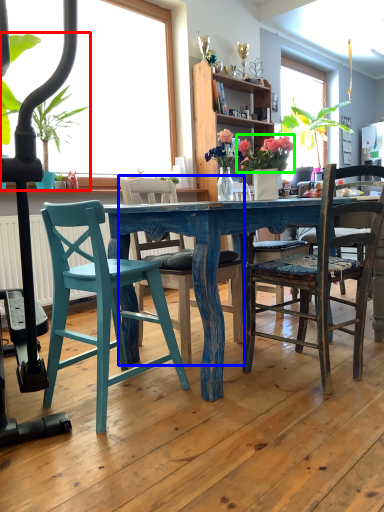
Question: Considering the real-world distances, which object is closest to houseplant (highlighted by a red box)? chair (highlighted by a blue box) or floral arrangement (highlighted by a green box).

Choices:
 (A) chair
 (B) floral arrangement

Answer: (A)